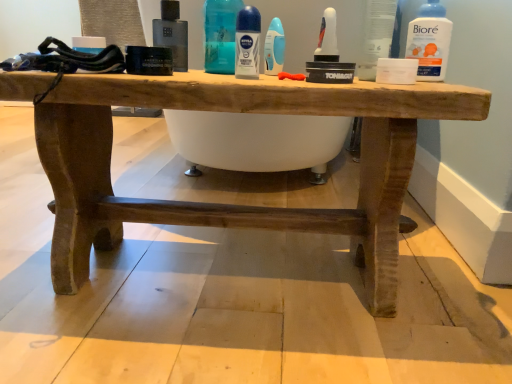
This screenshot has width=512, height=384. Find the location of `vacant area that is in front of blue glossy deodorant stick at center, positioned as the first cleaning product in right-to-left order`. vacant area that is in front of blue glossy deodorant stick at center, positioned as the first cleaning product in right-to-left order is located at coordinates (277, 77).